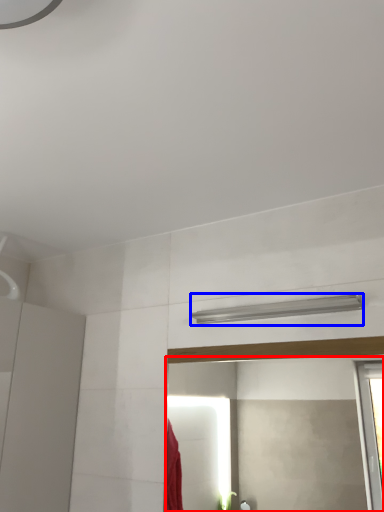
Question: Which object appears farthest to the camera in this image, mirror (highlighted by a red box) or shower (highlighted by a blue box)?

Choices:
 (A) mirror
 (B) shower

Answer: (B)